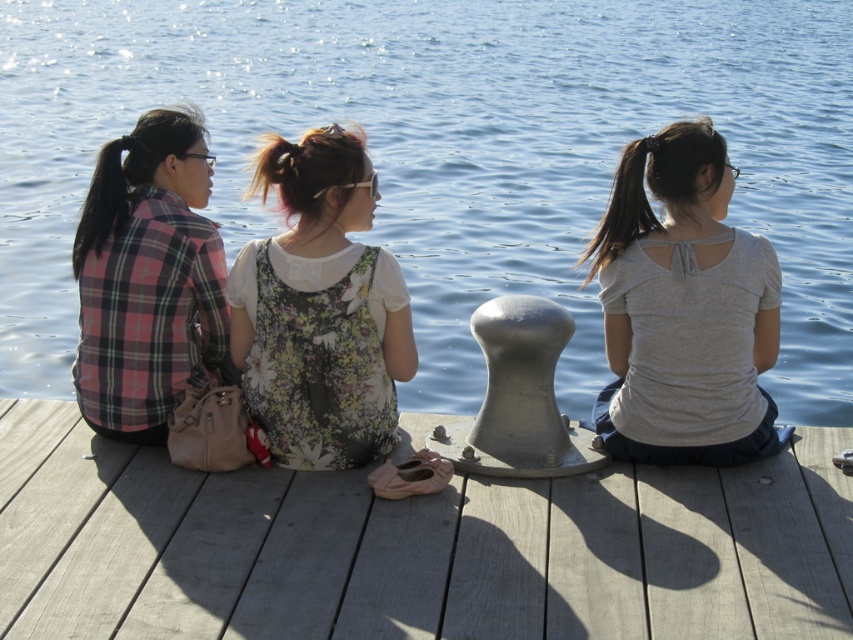
Question: In this image, where is gray matte shirt at center located relative to plaid fabric shirt at left?

Choices:
 (A) above
 (B) below

Answer: (B)

Question: Which point is farther from the camera taking this photo?

Choices:
 (A) (456, 616)
 (B) (699, 461)
 (C) (242, 358)

Answer: (B)

Question: Is blue water at center thinner than gray matte shirt at center?

Choices:
 (A) no
 (B) yes

Answer: (A)

Question: Which point appears closest to the camera in this image?

Choices:
 (A) (167, 410)
 (B) (93, 582)
 (C) (462, 323)
 (D) (332, 225)

Answer: (B)

Question: Observing the image, what is the correct spatial positioning of smooth wooden dock at center in reference to gray matte shirt at center?

Choices:
 (A) left
 (B) right

Answer: (A)

Question: Which object is farther from the camera taking this photo?

Choices:
 (A) blue water at center
 (B) smooth wooden dock at center
 (C) gray matte shirt at center
 (D) plaid fabric shirt at left

Answer: (A)